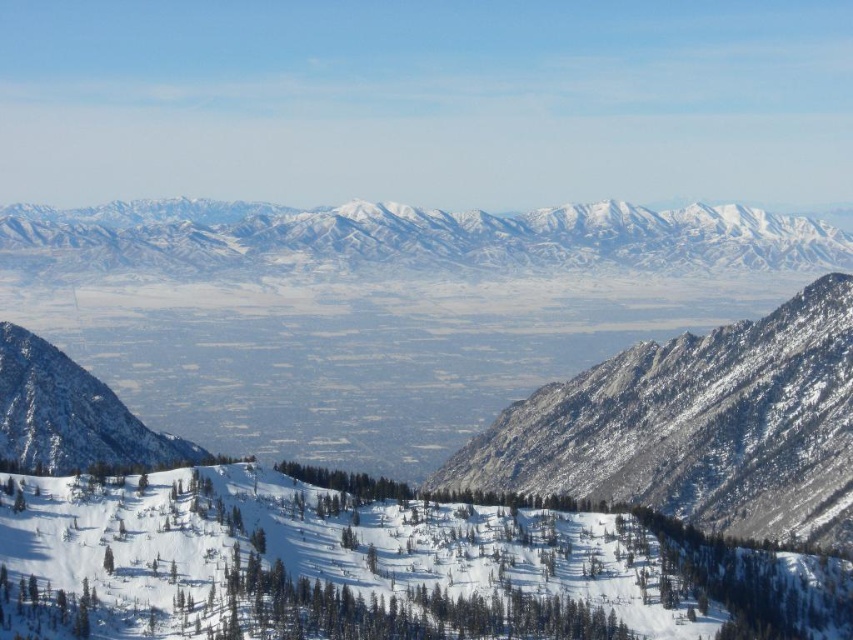
Which of these two, snowy granite mountain at center-right or snowy rocky mountain at left, stands taller?

Standing taller between the two is snowy granite mountain at center-right.

Which is more to the right, snowy granite mountain at center-right or snowy rocky mountain at left?

snowy granite mountain at center-right is more to the right.

Between point (543, 467) and point (73, 371), which one is positioned in front?

Point (73, 371) is more forward.

Locate an element on the screen. This screenshot has width=853, height=640. snowy granite mountain at center-right is located at coordinates (695, 428).

Which is more to the right, snowy granite mountains at center or snowy rocky mountain at left?

Positioned to the right is snowy granite mountains at center.

Find the location of `snowy granite mountains at center`. snowy granite mountains at center is located at coordinates click(x=415, y=237).

The width and height of the screenshot is (853, 640). I want to click on snowy granite mountains at center, so click(x=415, y=237).

At what (x,y) coordinates should I click in order to perform the action: click on snowy granite mountains at center. Please return your answer as a coordinate pair (x, y). The image size is (853, 640). Looking at the image, I should click on (415, 237).

What do you see at coordinates (695, 428) in the screenshot? Image resolution: width=853 pixels, height=640 pixels. I see `snowy granite mountain at center-right` at bounding box center [695, 428].

I want to click on snowy granite mountain at center-right, so click(695, 428).

At what (x,y) coordinates should I click in order to perform the action: click on snowy granite mountain at center-right. Please return your answer as a coordinate pair (x, y). This screenshot has width=853, height=640. Looking at the image, I should click on (695, 428).